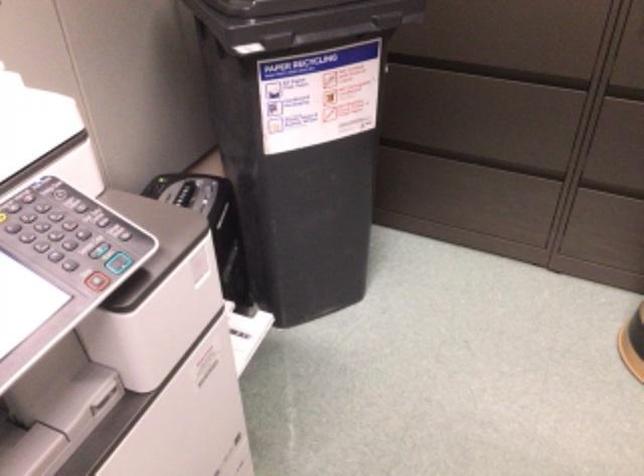
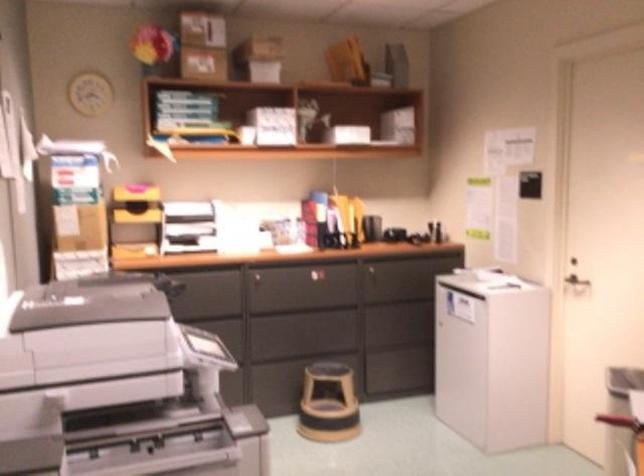
Question: I am providing you with two images of the same scene from different viewpoints. After the viewpoint changes to image2, which objects are now occluded?

Choices:
 (A) silver door handle
 (B) outdoor chair sitting surface
 (C) black bin lid
 (D) printer feeder lid

Answer: (C)